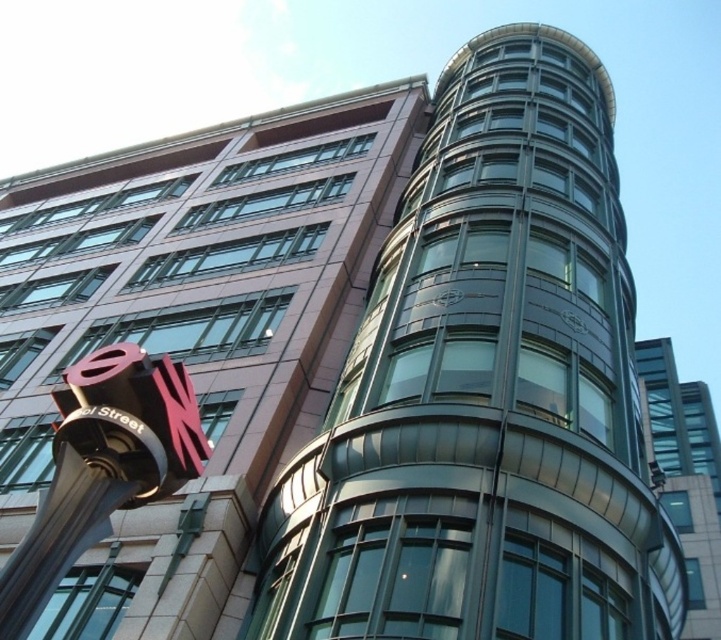
Between brushed metal sign at lower left and metallic glass building at right, which one has more height?

metallic glass building at right

Can you confirm if brushed metal sign at lower left is wider than metallic glass building at right?

In fact, brushed metal sign at lower left might be narrower than metallic glass building at right.

Is point (53, 538) in front of point (665, 364)?

Yes, point (53, 538) is closer to viewer.

Where is `brushed metal sign at lower left`? The image size is (721, 640). brushed metal sign at lower left is located at coordinates (102, 467).